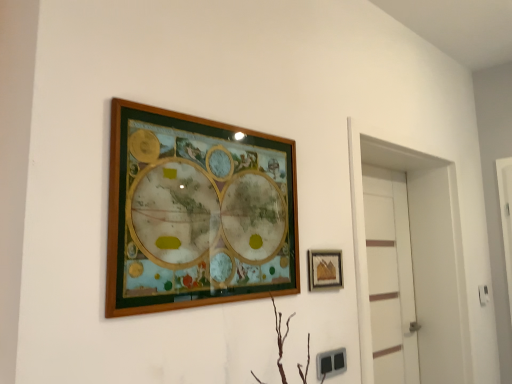
Question: Looking at their shapes, would you say white glossy door at right is wider or thinner than matte gold picture frame at right, arranged as the 1th picture frame when viewed from the back?

Choices:
 (A) wide
 (B) thin

Answer: (A)

Question: Based on their sizes in the image, would you say white glossy door at right is bigger or smaller than matte gold picture frame at right, arranged as the 1th picture frame when viewed from the back?

Choices:
 (A) big
 (B) small

Answer: (A)

Question: Based on their relative distances, which object is farther from the white matte door at right?

Choices:
 (A) white glossy door at right
 (B) matte gold picture frame at right, arranged as the 1th picture frame when viewed from the back
 (C) wooden picture frame at upper center, the 1th picture frame when ordered from front to back

Answer: (C)

Question: Which object is the farthest from the white glossy door at right?

Choices:
 (A) white matte door at right
 (B) wooden picture frame at upper center, the 1th picture frame when ordered from front to back
 (C) matte gold picture frame at right, arranged as the 1th picture frame when viewed from the back

Answer: (B)